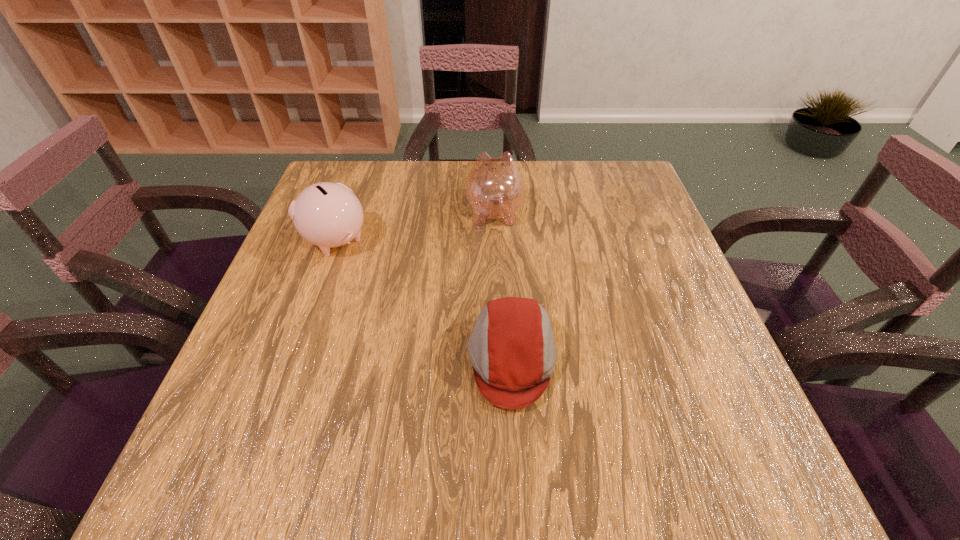
Identify the location of free space between the left piggy bank and the nearest object. Image resolution: width=960 pixels, height=540 pixels. point(423,300).

At what (x,y) coordinates should I click in order to perform the action: click on empty space between the leftmost object and the cap. Please return your answer as a coordinate pair (x, y). Looking at the image, I should click on (423, 300).

This screenshot has width=960, height=540. I want to click on vacant area that lies between the leftmost object and the cap, so click(x=423, y=300).

Image resolution: width=960 pixels, height=540 pixels. What are the coordinates of `free spot between the right piggy bank and the shortest object` in the screenshot? It's located at (503, 286).

At what (x,y) coordinates should I click in order to perform the action: click on free point between the leftmost object and the right piggy bank. Please return your answer as a coordinate pair (x, y). The image size is (960, 540). Looking at the image, I should click on (415, 226).

Identify the location of free spot between the nearest object and the right piggy bank. This screenshot has width=960, height=540. (503, 286).

Identify the location of blank region between the shortest object and the leftmost object. (423, 300).

The width and height of the screenshot is (960, 540). What are the coordinates of `free space between the right piggy bank and the leftmost object` in the screenshot? It's located at (415, 226).

This screenshot has width=960, height=540. Find the location of `object identified as the second closest to the left piggy bank`. object identified as the second closest to the left piggy bank is located at coordinates (512, 350).

Locate an element on the screen. Image resolution: width=960 pixels, height=540 pixels. object that is the second closest one to the left piggy bank is located at coordinates (512, 350).